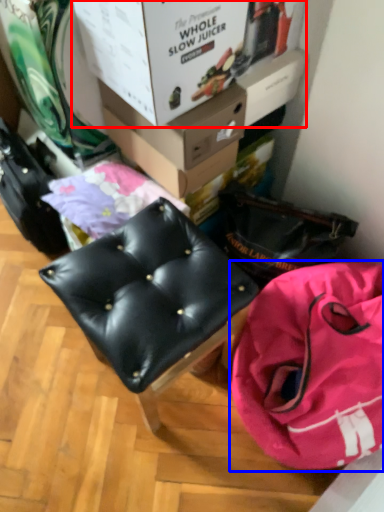
Question: Which object is further to the camera taking this photo, box (highlighted by a red box) or handbag (highlighted by a blue box)?

Choices:
 (A) box
 (B) handbag

Answer: (A)